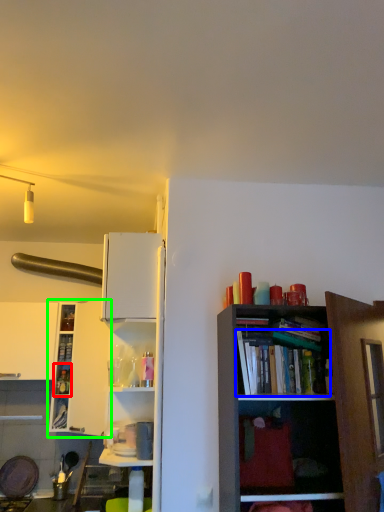
Question: Based on their relative distances, which object is nearer to cabinet (highlighted by a red box)? Choose from book (highlighted by a blue box) and shelf (highlighted by a green box).

Choices:
 (A) book
 (B) shelf

Answer: (B)